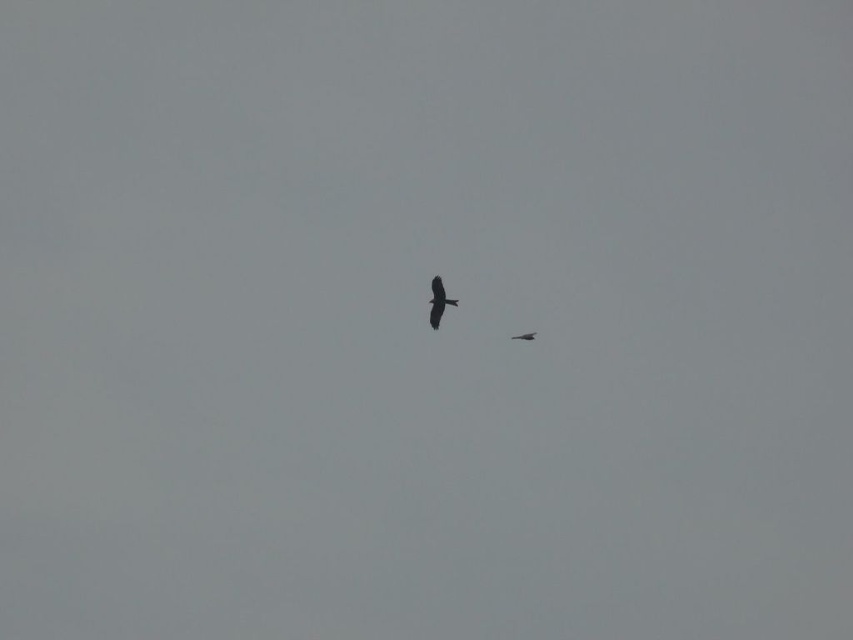
Is black matte crow at center above dark brown feathered bird at center?

Indeed, black matte crow at center is positioned over dark brown feathered bird at center.

Can you confirm if black matte crow at center is positioned below dark brown feathered bird at center?

No.

Identify the location of black matte crow at center. (438, 301).